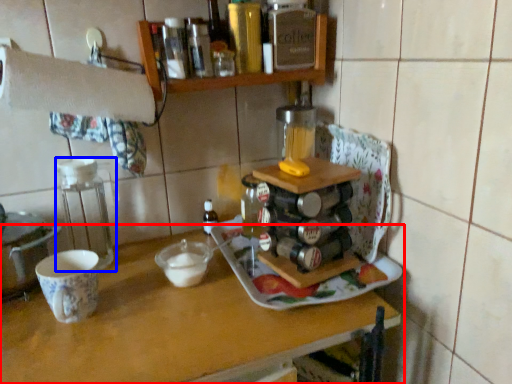
Question: Among these objects, which one is farthest to the camera, table (highlighted by a red box) or appliance (highlighted by a blue box)?

Choices:
 (A) table
 (B) appliance

Answer: (B)